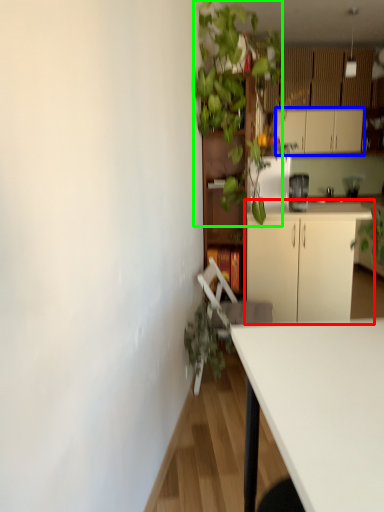
Question: Which object is positioned closest to cabinetry (highlighted by a red box)? Select from cabinetry (highlighted by a blue box) and vegetation (highlighted by a green box).

Choices:
 (A) cabinetry
 (B) vegetation

Answer: (B)